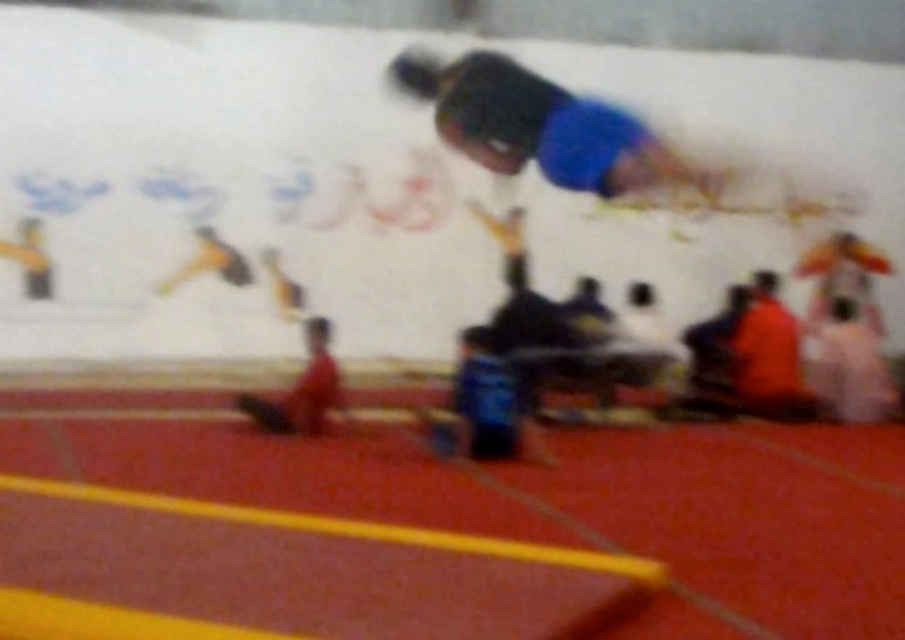
Question: Does blue matte skateboard at upper center appear on the left side of orange fabric shirt at right?

Choices:
 (A) no
 (B) yes

Answer: (B)

Question: Is blue matte skateboard at upper center to the right of orange fabric shirt at right from the viewer's perspective?

Choices:
 (A) yes
 (B) no

Answer: (B)

Question: Among these objects, which one is farthest from the camera?

Choices:
 (A) orange fabric shirt at right
 (B) blue matte skateboard at upper center

Answer: (B)

Question: Can you confirm if blue matte skateboard at upper center is positioned to the left of orange fabric shirt at right?

Choices:
 (A) yes
 (B) no

Answer: (A)